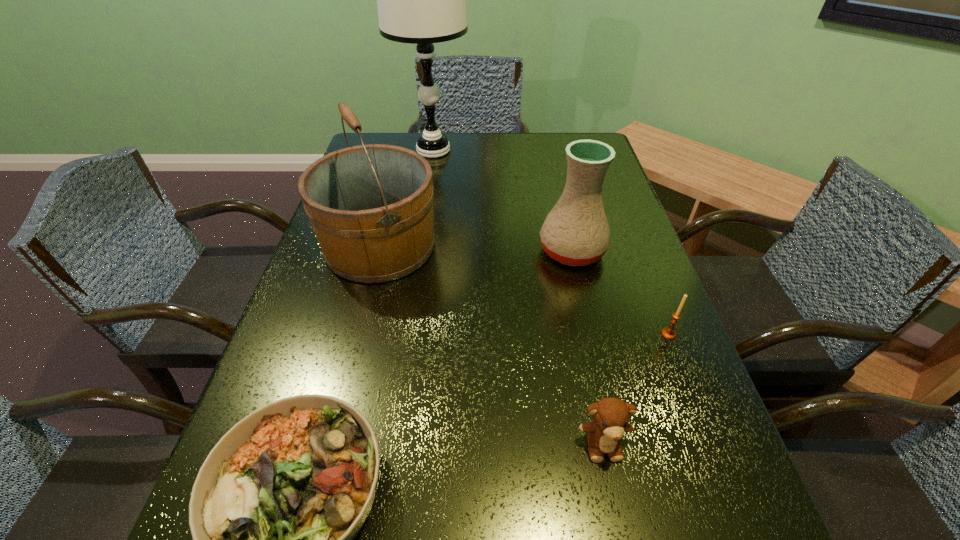
Locate an element on the screen. free space at the right edge is located at coordinates (654, 526).

Identify the location of free space at the far left corner. (368, 141).

Where is `blank region between the teddy bear and the fourth farthest object`? This screenshot has width=960, height=540. blank region between the teddy bear and the fourth farthest object is located at coordinates (636, 389).

Identify the location of free space that is in between the teddy bear and the third tallest object. (588, 347).

You are a GUI agent. You are given a task and a screenshot of the screen. Output one action in this format:
    pyautogui.click(x=<x>, y=<y>)
    Task: Click on the vacant area between the candle_holder and the bucket
    Image resolution: width=960 pixels, height=540 pixels.
    Given the screenshot: What is the action you would take?
    pyautogui.click(x=524, y=290)

The width and height of the screenshot is (960, 540). In order to click on object that can be found as the fifth closest to the salad plate in this screenshot , I will do `click(421, 0)`.

This screenshot has width=960, height=540. Find the location of `the closest object relative to the farthest object`. the closest object relative to the farthest object is located at coordinates (371, 206).

At what (x,y) coordinates should I click in order to perform the action: click on blank area in the image that satisfies the following two spatial constraints: 1. on the front side of the third tallest object; 2. on the right side of the table lamp. Please return your answer as a coordinate pair (x, y). Looking at the image, I should click on (418, 251).

Where is `vacant space that satisfies the following two spatial constraints: 1. on the front side of the third nearest object; 2. on the right side of the pottery`? The height and width of the screenshot is (540, 960). vacant space that satisfies the following two spatial constraints: 1. on the front side of the third nearest object; 2. on the right side of the pottery is located at coordinates (591, 334).